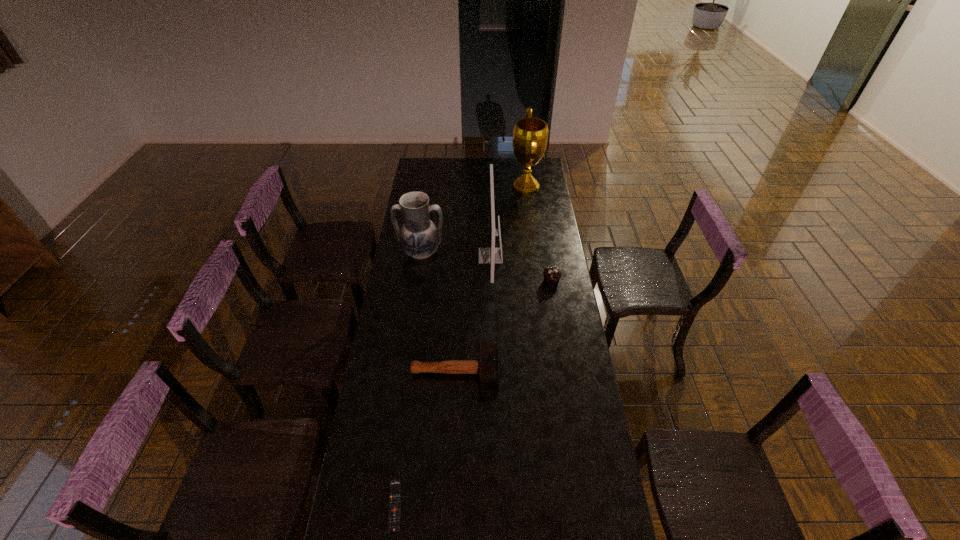
Locate an element on the screen. The height and width of the screenshot is (540, 960). free space between the award and the fifth tallest object is located at coordinates (491, 279).

Find the location of a particular element. Image resolution: width=960 pixels, height=540 pixels. empty location between the pitcher and the remote control is located at coordinates (408, 379).

Image resolution: width=960 pixels, height=540 pixels. I want to click on free space between the pitcher and the farthest object, so click(x=473, y=219).

Find the location of a particular element. free space between the fifth tallest object and the shortest object is located at coordinates (425, 439).

Locate an element on the screen. The width and height of the screenshot is (960, 540). empty location between the cupcake and the monitor is located at coordinates (521, 268).

Identify which object is located as the fifth nearest to the pitcher. Please provide its 2D coordinates. Your answer should be formatted as a tuple, i.e. [(x, y)], where the tuple contains the x and y coordinates of a point satisfying the conditions above.

[(394, 514)]

Identify which object is located as the second nearest to the shortest object. Please provide its 2D coordinates. Your answer should be formatted as a tuple, i.e. [(x, y)], where the tuple contains the x and y coordinates of a point satisfying the conditions above.

[(491, 255)]

Locate an element on the screen. Image resolution: width=960 pixels, height=540 pixels. free space that satisfies the following two spatial constraints: 1. on the front-facing side of the farthest object; 2. on the front-facing side of the pitcher is located at coordinates (535, 252).

Where is `vacant space that satisfies the following two spatial constraints: 1. on the front-facing side of the award; 2. on the front-facing side of the pitcher`? The height and width of the screenshot is (540, 960). vacant space that satisfies the following two spatial constraints: 1. on the front-facing side of the award; 2. on the front-facing side of the pitcher is located at coordinates (x=535, y=252).

The width and height of the screenshot is (960, 540). Identify the location of vacant point that satisfies the following two spatial constraints: 1. on the front-facing side of the pitcher; 2. on the right side of the cupcake. (417, 280).